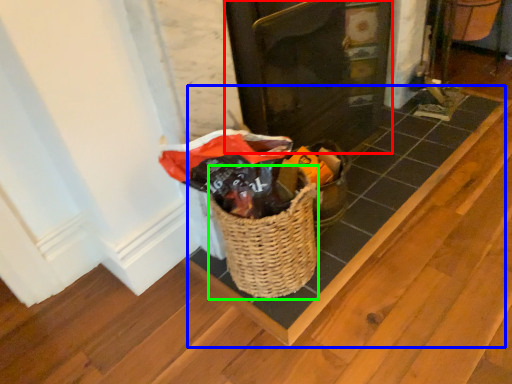
Question: Which object is the farthest from door (highlighted by a red box)? Choose among these: plank (highlighted by a blue box) or basket (highlighted by a green box).

Choices:
 (A) plank
 (B) basket

Answer: (B)